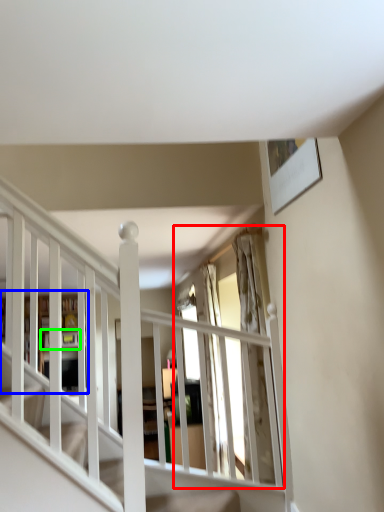
Question: Which object is the closest to the window (highlighted by a red box)? Choose among these: bookshelf (highlighted by a blue box) or shelf (highlighted by a green box).

Choices:
 (A) bookshelf
 (B) shelf

Answer: (A)